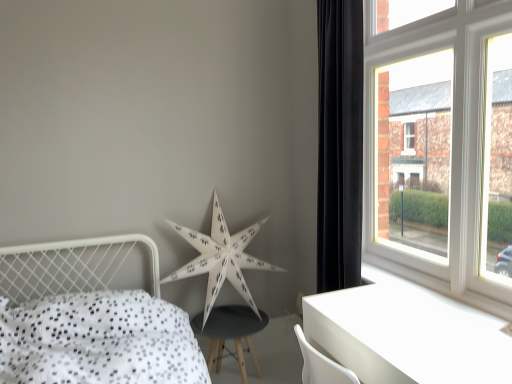
Question: Considering the relative positions of white dotted fabric bed at lower left and white glossy table at lower right in the image provided, is white dotted fabric bed at lower left to the left or to the right of white glossy table at lower right?

Choices:
 (A) left
 (B) right

Answer: (A)

Question: From a real-world perspective, is white dotted fabric bed at lower left positioned above or below white glossy table at lower right?

Choices:
 (A) below
 (B) above

Answer: (B)

Question: Estimate the real-world distances between objects in this image. Which object is closer to the white glossy table at lower right?

Choices:
 (A) white wooden window at upper right
 (B) white paper star at center
 (C) white dotted fabric bed at lower left
 (D) black velvet curtain at right

Answer: (A)

Question: Estimate the real-world distances between objects in this image. Which object is farther from the white dotted fabric bed at lower left?

Choices:
 (A) black velvet curtain at right
 (B) white wooden window at upper right
 (C) white paper star at center
 (D) white glossy table at lower right

Answer: (B)